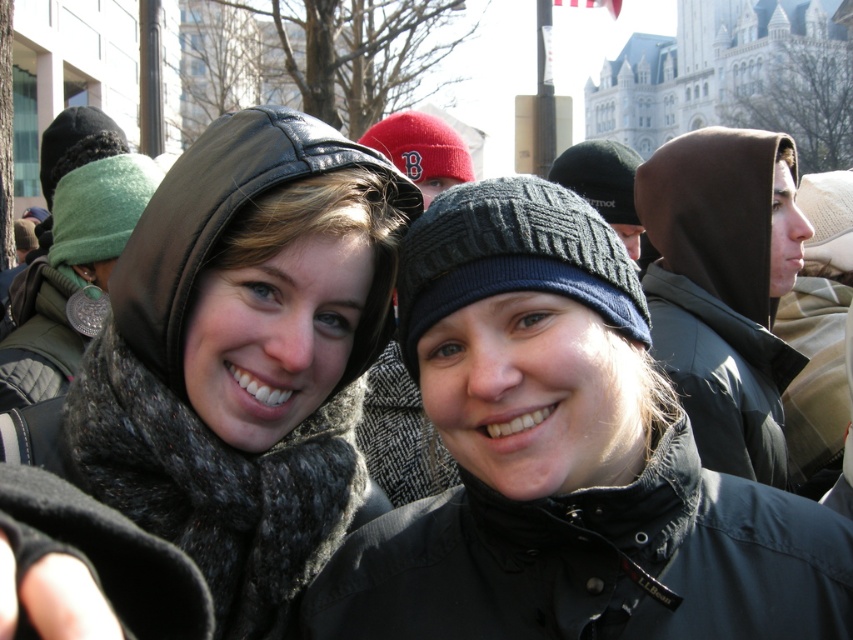
You are standing at the point with coordinates point (x=279, y=388) and want to take a photo of the point (x=611, y=346). Is there any obstruction between you and your target?

Point (x=611, y=346) is in front of point (x=279, y=388), so there is no obstruction between you and the target point.

Looking at this image, you are standing in the scene and want to touch the matte black hood at center. If you move your hand to the point at coordinates (244, 356), will you be touching the matte black hood at center?

Yes, the point at coordinates (244, 356) is on the matte black hood at center, so touching that point would indeed be touching the matte black hood at center.

You are a fashion designer observing the two hoods in the scene. Which hood is bigger in size between the matte black hood at center and the brown matte hood at right?

The matte black hood at center has a larger size compared to the brown matte hood at right.